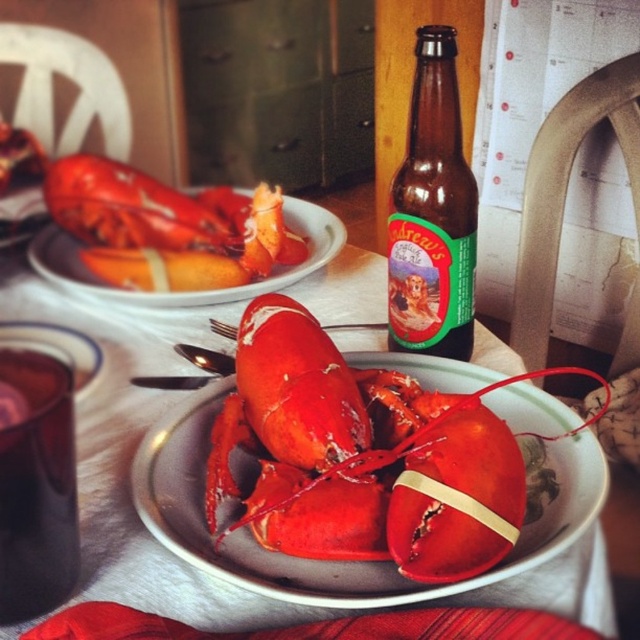
Question: Which point is farther from the camera taking this photo?

Choices:
 (A) (120, 531)
 (B) (464, 310)
 (C) (52, 486)

Answer: (B)

Question: Which point is closer to the camera taking this photo?

Choices:
 (A) (584, 568)
 (B) (472, 212)
 (C) (280, 392)
 (D) (248, 189)

Answer: (A)

Question: From the image, what is the correct spatial relationship of shiny red lobster at center in relation to transparent glass jar at lower left?

Choices:
 (A) left
 (B) right

Answer: (B)

Question: Is shiny red lobster at center to the right of metallic copper cup at lower left from the viewer's perspective?

Choices:
 (A) no
 (B) yes

Answer: (B)

Question: In this image, where is matte ceramic plate at center located relative to transparent glass jar at lower left?

Choices:
 (A) above
 (B) below

Answer: (B)

Question: Based on their relative distances, which object is farther from the matte ceramic plate at center?

Choices:
 (A) matte ceramic lobster at center
 (B) brown glass bottle at center
 (C) shiny red lobster at center
 (D) metallic copper cup at lower left

Answer: (B)